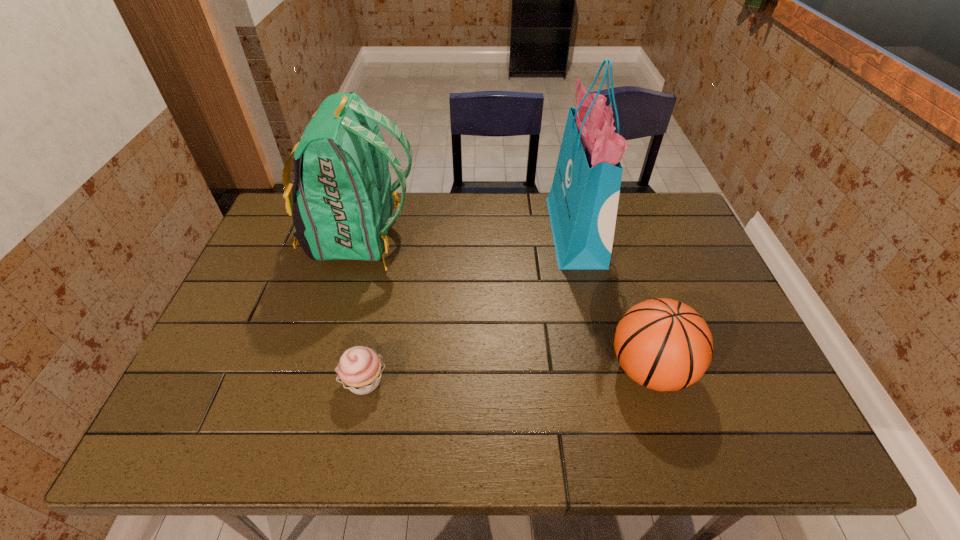
Locate an element on the screen. The width and height of the screenshot is (960, 540). free spot that satisfies the following two spatial constraints: 1. on the back of the cupcake; 2. on the left side of the backpack is located at coordinates (319, 381).

Locate an element on the screen. vacant space that satisfies the following two spatial constraints: 1. on the back of the backpack; 2. on the back side of the second shortest object is located at coordinates (322, 369).

What are the coordinates of `free location that satisfies the following two spatial constraints: 1. on the back side of the shortest object; 2. on the left side of the basketball` in the screenshot? It's located at (367, 369).

Where is `vacant space that satisfies the following two spatial constraints: 1. on the back side of the basketball; 2. on the back of the third shortest object`? vacant space that satisfies the following two spatial constraints: 1. on the back side of the basketball; 2. on the back of the third shortest object is located at coordinates (609, 237).

What are the coordinates of `vacant area in the image that satisfies the following two spatial constraints: 1. on the back of the backpack; 2. on the right side of the cupcake` in the screenshot? It's located at (319, 381).

The height and width of the screenshot is (540, 960). Find the location of `free space in the image that satisfies the following two spatial constraints: 1. on the back of the cupcake; 2. on the right side of the backpack`. free space in the image that satisfies the following two spatial constraints: 1. on the back of the cupcake; 2. on the right side of the backpack is located at coordinates (319, 381).